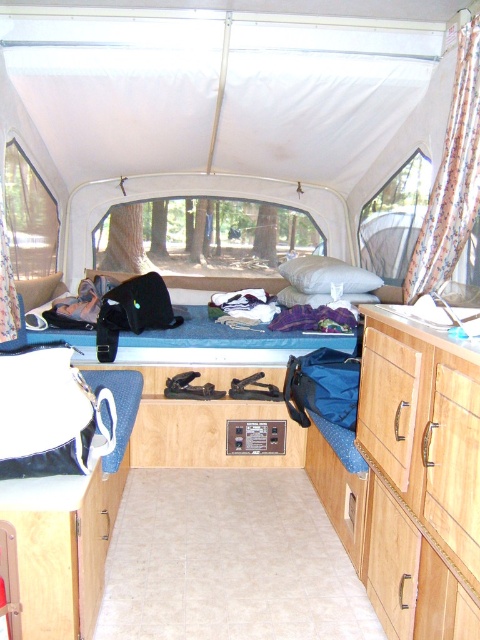
You are inside a camper van and want to check the view outside through the window. However, the floral fabric curtain at right and the blue fabric bed at center are blocking your view. Which object is closer to the window so you can move it first?

The floral fabric curtain at right is located above the blue fabric bed at center, meaning it is closer to the window. Move the floral fabric curtain at right first to check the view outside.